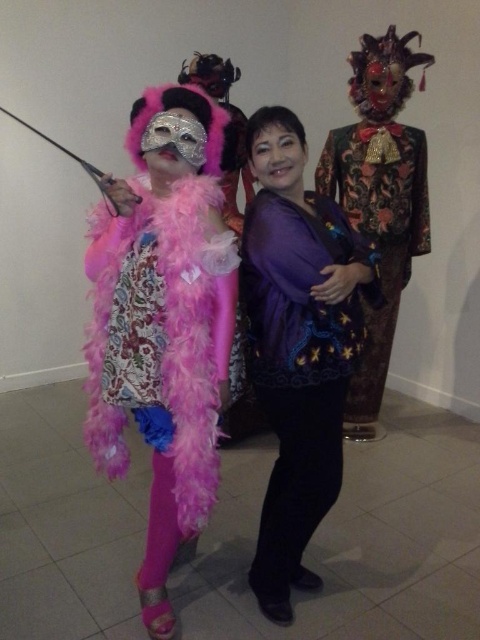
You are a photographer setting up for a photoshoot. You need to position the fuzzy pink boa at center and the purple satin blouse at center in a way that they are aligned along the horizontal axis. Which side should each item be placed on to match their current positions in the image?

The fuzzy pink boa at center should be placed on the left side and the purple satin blouse at center on the right side since the fuzzy pink boa at center is to the left of purple satin blouse at center in the image.

You are a photographer setting up a shoot in a studio with these two subjects. You need to position a spotlight so it illuminates the fuzzy pink boa at center without casting a shadow from the velvet brocade robe at right. Is this possible given their current positions?

The fuzzy pink boa at center is in front of the velvet brocade robe at right, so the spotlight can be placed behind the fuzzy pink boa at center to illuminate it while avoiding casting a shadow from the velvet brocade robe at right.

You are taking a photo of two people in the room. You notice two points marked in the image. The first point is at coordinate point (157, 560) and the second point is at coordinate point (393, 257). Which of these two points is closer to the camera?

Point (157, 560) is closer to the camera than point (393, 257).